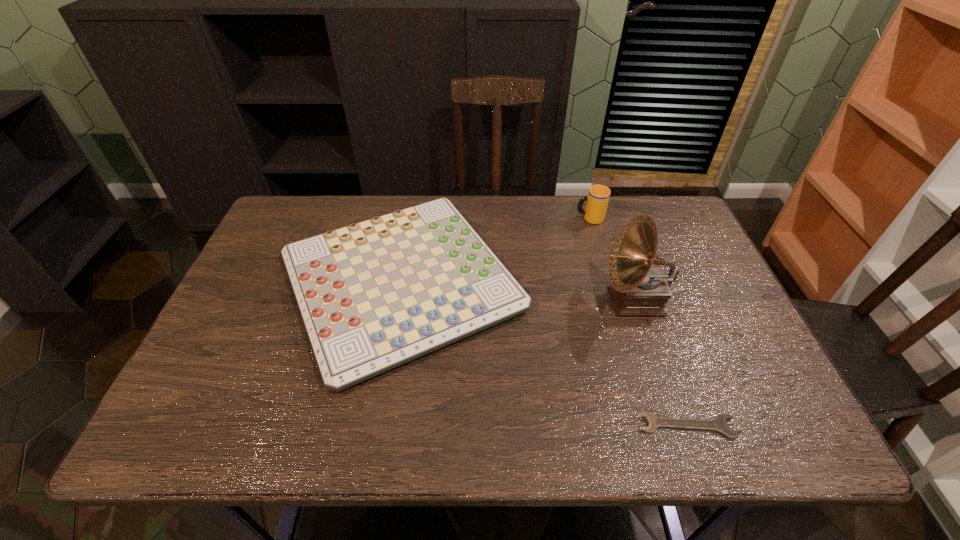
Where is `vacant space in between the gameboard and the wrench`? This screenshot has width=960, height=540. vacant space in between the gameboard and the wrench is located at coordinates (544, 354).

You are a GUI agent. You are given a task and a screenshot of the screen. Output one action in this format:
    pyautogui.click(x=<x>, y=<y>)
    Task: Click on the vacant space in between the tallest object and the shortest object
    The image size is (960, 540).
    Given the screenshot: What is the action you would take?
    pyautogui.click(x=661, y=363)

Select which object appears as the third closest to the tallest object. Please provide its 2D coordinates. Your answer should be formatted as a tuple, i.e. [(x, y)], where the tuple contains the x and y coordinates of a point satisfying the conditions above.

[(597, 200)]

You are a GUI agent. You are given a task and a screenshot of the screen. Output one action in this format:
    pyautogui.click(x=<x>, y=<y>)
    Task: Click on the object that is the nearest to the leftmost object
    
    Given the screenshot: What is the action you would take?
    pyautogui.click(x=597, y=200)

Image resolution: width=960 pixels, height=540 pixels. I want to click on vacant region that satisfies the following two spatial constraints: 1. on the horn of the wrench; 2. on the left side of the tallest object, so click(x=677, y=426).

The width and height of the screenshot is (960, 540). What are the coordinates of `vacant space that satisfies the following two spatial constraints: 1. on the horn of the phonograph record; 2. on the back side of the shortest object` in the screenshot? It's located at (677, 426).

Locate an element on the screen. free location that satisfies the following two spatial constraints: 1. on the horn of the shortest object; 2. on the right side of the tallest object is located at coordinates click(677, 426).

Locate an element on the screen. free space that satisfies the following two spatial constraints: 1. on the horn of the phonograph record; 2. on the back side of the nearest object is located at coordinates (677, 426).

This screenshot has width=960, height=540. Identify the location of free spot that satisfies the following two spatial constraints: 1. on the horn of the tallest object; 2. on the back side of the wrench. (677, 426).